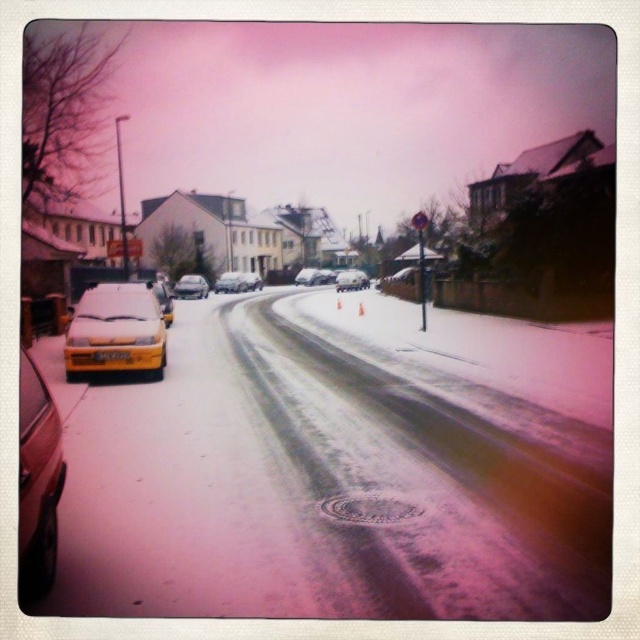
Can you confirm if yellow matte taxi at left is thinner than shiny silver sedan at center?

Correct, yellow matte taxi at left's width is less than shiny silver sedan at center's.

Find the location of `yellow matte taxi at left`. yellow matte taxi at left is located at coordinates (115, 332).

Find the location of `yellow matte taxi at left`. yellow matte taxi at left is located at coordinates (115, 332).

Who is more distant from viewer, (109, 333) or (148, 282)?

The point (148, 282) is behind.

Is yellow matte taxi at left shorter than yellow matte car at left?

Yes, yellow matte taxi at left is shorter than yellow matte car at left.

The width and height of the screenshot is (640, 640). What are the coordinates of `yellow matte taxi at left` in the screenshot? It's located at (115, 332).

Find the location of a particular element. yellow matte taxi at left is located at coordinates (115, 332).

Measure the distance from metallic gold car at left to shiny silver sedan at center.

metallic gold car at left and shiny silver sedan at center are 52.77 meters apart from each other.

Is metallic gold car at left to the right of shiny silver sedan at center from the viewer's perspective?

Indeed, metallic gold car at left is positioned on the right side of shiny silver sedan at center.

You are a GUI agent. You are given a task and a screenshot of the screen. Output one action in this format:
    pyautogui.click(x=<x>, y=<y>)
    Task: Click on the metallic gold car at left
    
    Given the screenshot: What is the action you would take?
    pyautogui.click(x=36, y=481)

At what (x,y) coordinates should I click in order to perform the action: click on metallic gold car at left. Please return your answer as a coordinate pair (x, y). Image resolution: width=640 pixels, height=640 pixels. Looking at the image, I should click on (36, 481).